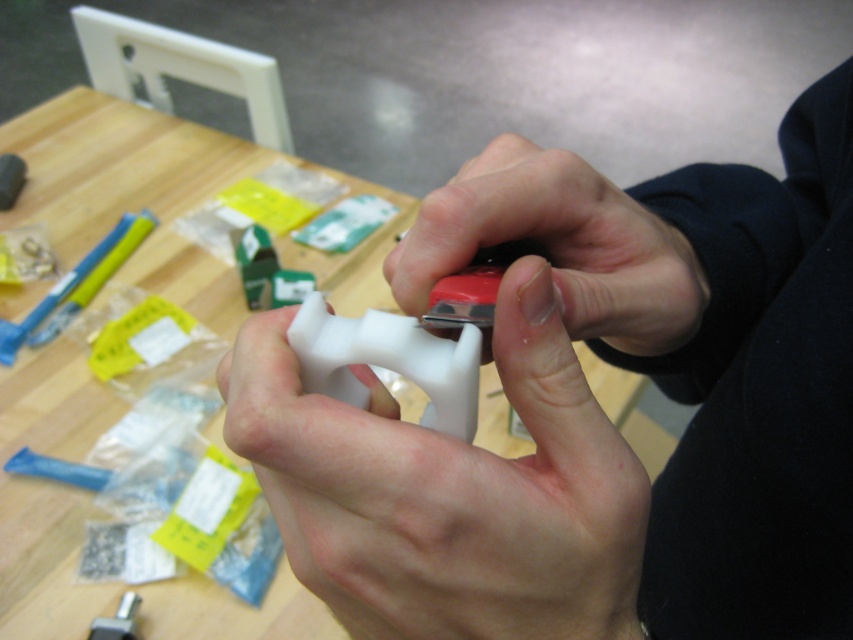
You are a technician working on a game controller. You see the wooden table at center and the white matte game controller at center. Which object is closer to you?

The wooden table at center is closer to you because the white matte game controller at center is behind it.

You are a repair technician working on a project. You have a white matte plastic at center and a wooden table at center in your workspace. Which object is narrower in width?

The white matte plastic at center has a lesser width compared to wooden table at center, so it is narrower.